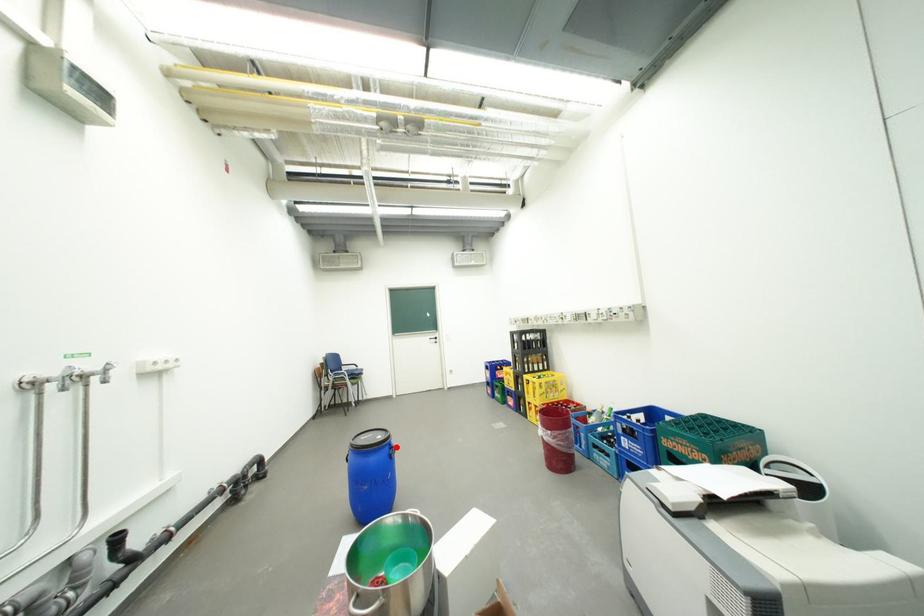
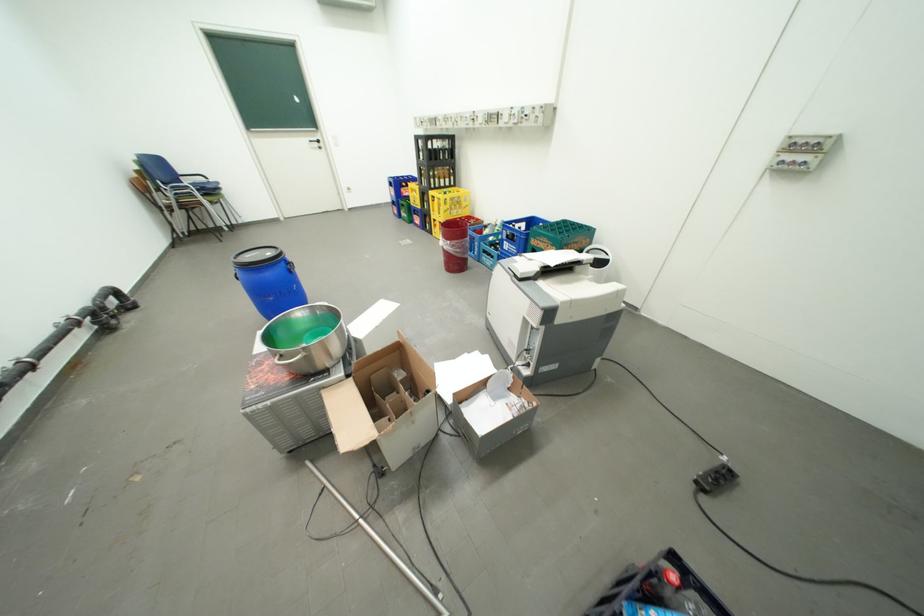
Question: I am providing you with two images of the same scene from different viewpoints. Given a red point in image1, look at the same physical point in image2. Is it:

Choices:
 (A) Closer to the viewpoint
 (B) Farther from the viewpoint

Answer: (A)